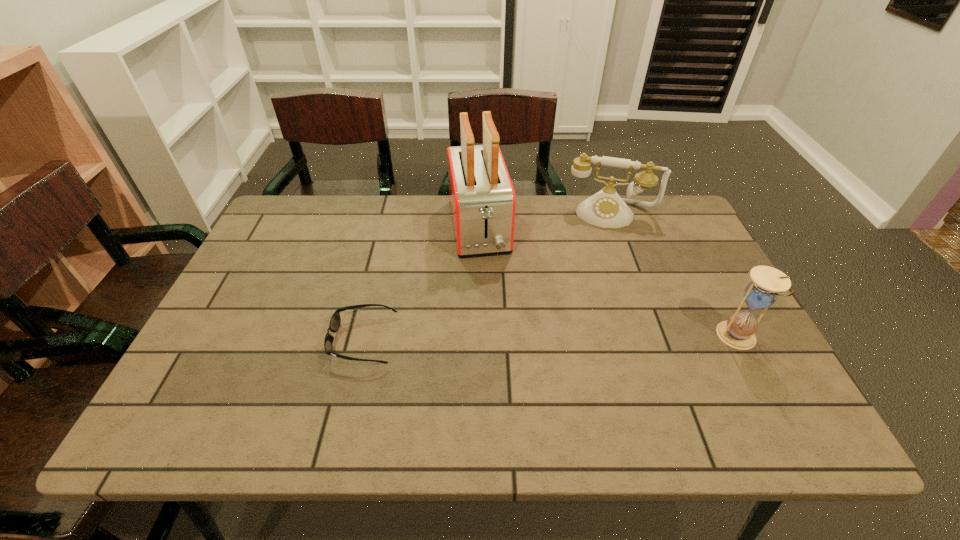
Find the location of a particular element. Image resolution: width=960 pixels, height=540 pixels. telephone that is at the right edge is located at coordinates (606, 209).

Locate an element on the screen. This screenshot has height=540, width=960. object at the far right corner is located at coordinates (606, 209).

In the image, there is a desktop. Identify the location of blank space at the far edge. The image size is (960, 540). (548, 200).

In the image, there is a desktop. Identify the location of vacant region at the near edge. (656, 383).

In the image, there is a desktop. Identify the location of free space at the left edge. (275, 333).

Locate an element on the screen. free spot at the right edge of the desktop is located at coordinates (758, 356).

The image size is (960, 540). I want to click on free region at the far left corner of the desktop, so click(286, 238).

Locate an element on the screen. The width and height of the screenshot is (960, 540). vacant position at the near right corner of the desktop is located at coordinates (751, 384).

You are a GUI agent. You are given a task and a screenshot of the screen. Output one action in this format:
    pyautogui.click(x=<x>, y=<y>)
    Task: Click on the empty space that is in between the second object from left to right and the second object from right to left
    
    Given the screenshot: What is the action you would take?
    pyautogui.click(x=545, y=221)

You are a GUI agent. You are given a task and a screenshot of the screen. Output one action in this format:
    pyautogui.click(x=<x>, y=<y>)
    Task: Click on the free space between the hourglass and the shortest object
    
    Given the screenshot: What is the action you would take?
    pyautogui.click(x=550, y=339)